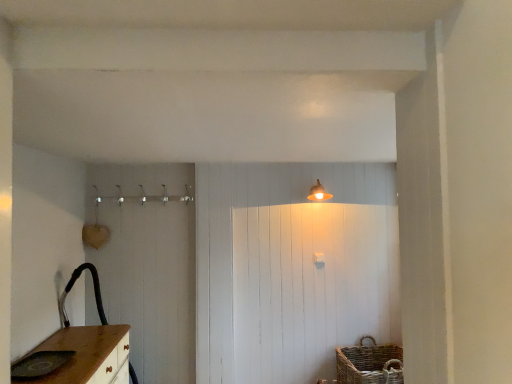
Question: Is matte gold light fixture at upper center shorter than matte gray sink at lower left?

Choices:
 (A) no
 (B) yes

Answer: (A)

Question: Is matte gold light fixture at upper center looking in the opposite direction of matte gray sink at lower left?

Choices:
 (A) yes
 (B) no

Answer: (B)

Question: Could you tell me if matte gold light fixture at upper center is facing matte gray sink at lower left?

Choices:
 (A) no
 (B) yes

Answer: (A)

Question: Does matte gold light fixture at upper center have a greater width compared to matte gray sink at lower left?

Choices:
 (A) no
 (B) yes

Answer: (A)

Question: Considering the relative sizes of matte gold light fixture at upper center and matte gray sink at lower left in the image provided, is matte gold light fixture at upper center smaller than matte gray sink at lower left?

Choices:
 (A) yes
 (B) no

Answer: (B)

Question: Is woven brown basket at lower right taller or shorter than matte gray sink at lower left?

Choices:
 (A) tall
 (B) short

Answer: (A)

Question: From the image's perspective, is woven brown basket at lower right positioned above or below matte gray sink at lower left?

Choices:
 (A) below
 (B) above

Answer: (A)

Question: Choose the correct answer: Is woven brown basket at lower right inside matte gray sink at lower left or outside it?

Choices:
 (A) inside
 (B) outside

Answer: (B)

Question: From a real-world perspective, is woven brown basket at lower right above or below matte gray sink at lower left?

Choices:
 (A) below
 (B) above

Answer: (A)

Question: From a real-world perspective, is matte gold light fixture at upper center above or below matte gray sink at lower left?

Choices:
 (A) below
 (B) above

Answer: (B)

Question: Do you think matte gold light fixture at upper center is within matte gray sink at lower left, or outside of it?

Choices:
 (A) inside
 (B) outside

Answer: (B)

Question: Considering the positions of matte gold light fixture at upper center and matte gray sink at lower left in the image, is matte gold light fixture at upper center taller or shorter than matte gray sink at lower left?

Choices:
 (A) tall
 (B) short

Answer: (A)

Question: Considering the relative positions of matte gold light fixture at upper center and matte gray sink at lower left in the image provided, is matte gold light fixture at upper center to the left or to the right of matte gray sink at lower left?

Choices:
 (A) right
 (B) left

Answer: (A)

Question: Is woven brown basket at lower right spatially inside matte gold light fixture at upper center, or outside of it?

Choices:
 (A) outside
 (B) inside

Answer: (A)

Question: From the image's perspective, is woven brown basket at lower right located above or below matte gold light fixture at upper center?

Choices:
 (A) above
 (B) below

Answer: (B)